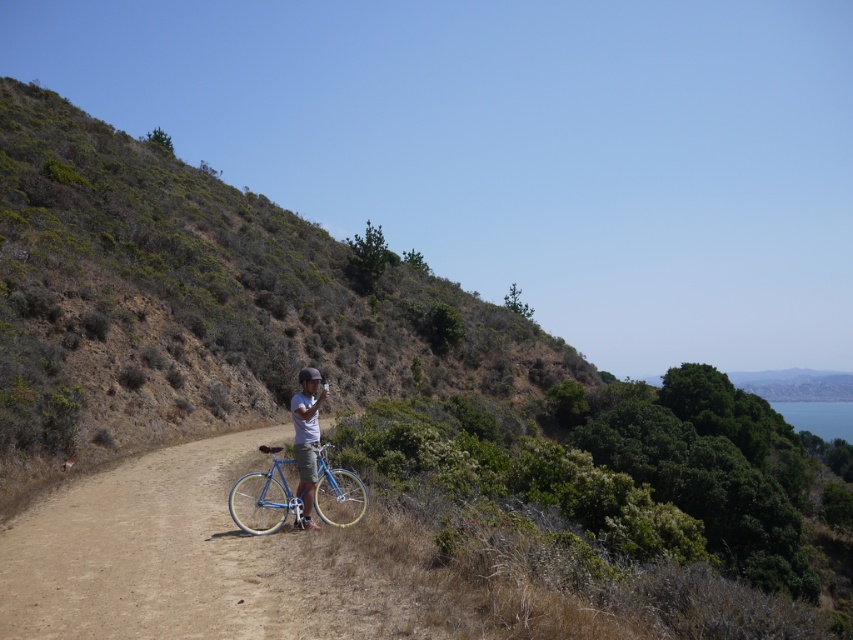
Who is lower down, shiny blue frame at center or matte blue bicycle at center?

shiny blue frame at center is lower down.

Measure the distance from shiny blue frame at center to matte blue bicycle at center.

shiny blue frame at center is 1.57 meters from matte blue bicycle at center.

Locate an element on the screen. shiny blue frame at center is located at coordinates (264, 499).